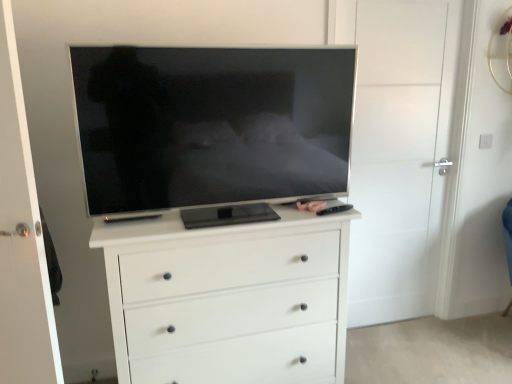
Question: Is white matte door at center, the 2th door from the left, facing towards matte black remote control at center?

Choices:
 (A) yes
 (B) no

Answer: (B)

Question: Does white matte door at center, the second door viewed from the front, have a lesser height compared to matte black remote control at center?

Choices:
 (A) no
 (B) yes

Answer: (A)

Question: From a real-world perspective, does white matte door at center, the 1th door when ordered from right to left, sit lower than matte black remote control at center?

Choices:
 (A) yes
 (B) no

Answer: (A)

Question: Is white matte door at center, the 1th door when ordered from right to left, looking in the opposite direction of matte black remote control at center?

Choices:
 (A) yes
 (B) no

Answer: (B)

Question: Is white matte door at center, the 1th door when ordered from right to left, positioned beyond the bounds of matte black remote control at center?

Choices:
 (A) no
 (B) yes

Answer: (B)

Question: In the image, is black plastic remote at right positioned in front of or behind matte black remote control at center?

Choices:
 (A) behind
 (B) front

Answer: (B)

Question: Looking at their shapes, would you say black plastic remote at right is wider or thinner than matte black remote control at center?

Choices:
 (A) thin
 (B) wide

Answer: (A)

Question: Is black plastic remote at right inside the boundaries of matte black remote control at center, or outside?

Choices:
 (A) outside
 (B) inside

Answer: (A)

Question: Does point coord(339,211) appear closer or farther from the camera than point coord(297,201)?

Choices:
 (A) closer
 (B) farther

Answer: (A)

Question: In the image, is white matte door at center, which is counted as the second door, starting from the right, positioned in front of or behind white matte chest of drawers at center?

Choices:
 (A) front
 (B) behind

Answer: (A)

Question: From the image's perspective, is white matte door at center, the first door when ordered from left to right, positioned above or below white matte chest of drawers at center?

Choices:
 (A) below
 (B) above

Answer: (B)

Question: Does point (6, 173) appear closer or farther from the camera than point (223, 291)?

Choices:
 (A) closer
 (B) farther

Answer: (A)

Question: From their relative heights in the image, would you say white matte door at center, which is counted as the second door, starting from the right, is taller or shorter than white matte chest of drawers at center?

Choices:
 (A) tall
 (B) short

Answer: (A)

Question: Is matte black tv at center in front of or behind matte black remote control at center in the image?

Choices:
 (A) front
 (B) behind

Answer: (A)

Question: In terms of height, does matte black tv at center look taller or shorter compared to matte black remote control at center?

Choices:
 (A) tall
 (B) short

Answer: (A)